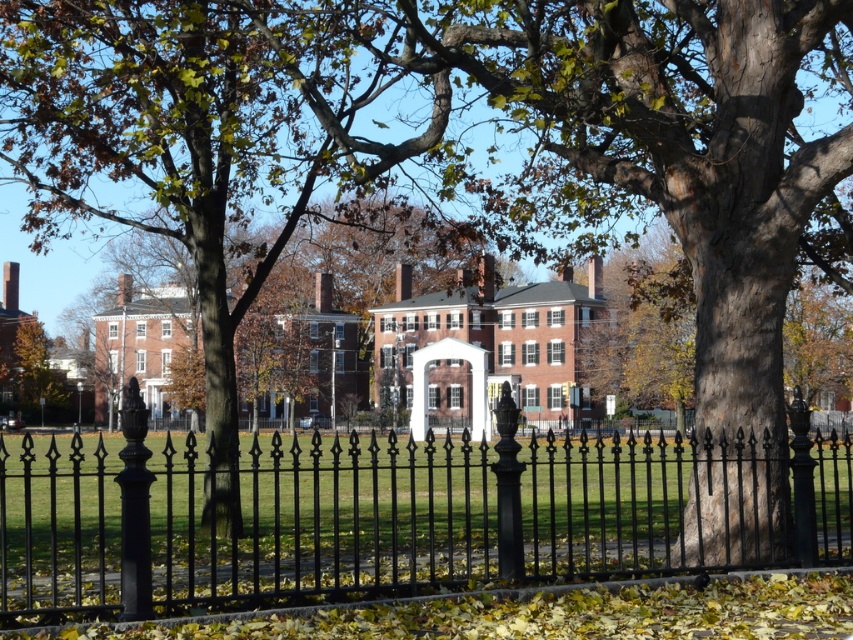
Question: Among these points, which one is nearest to the camera?

Choices:
 (A) (154, 492)
 (B) (41, 337)

Answer: (A)

Question: Does black wrought iron fence at center come in front of brown wood tree at center?

Choices:
 (A) yes
 (B) no

Answer: (A)

Question: Does black wrought iron fence at center come in front of brown wood tree at center?

Choices:
 (A) no
 (B) yes

Answer: (B)

Question: Does black wrought iron fence at center appear under brown wood tree at center?

Choices:
 (A) no
 (B) yes

Answer: (B)

Question: Which object is closer to the camera taking this photo?

Choices:
 (A) brown wood tree at center
 (B) black wrought iron fence at center

Answer: (B)

Question: Which object appears closest to the camera in this image?

Choices:
 (A) brown wood tree at center
 (B) black wrought iron fence at center

Answer: (B)